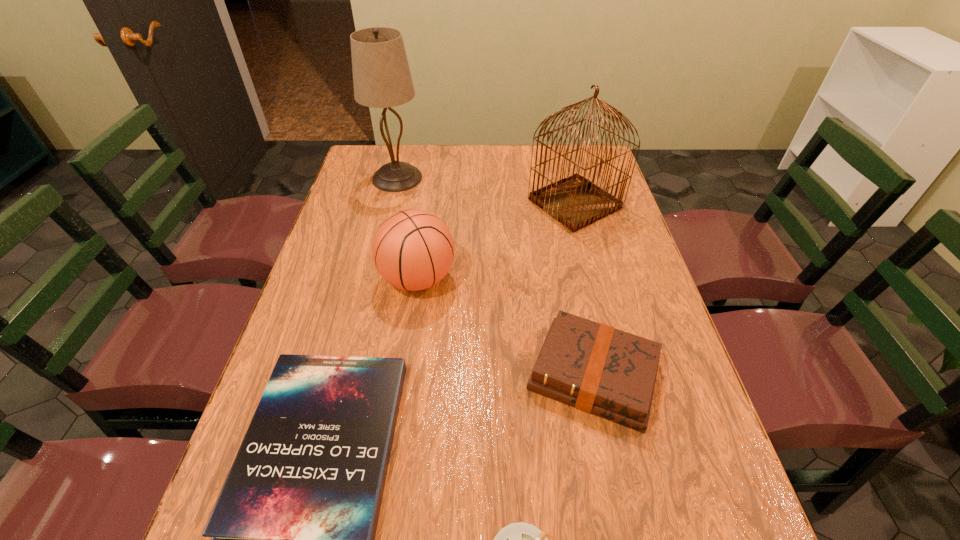
The height and width of the screenshot is (540, 960). In order to click on the tallest object in this screenshot , I will do `click(381, 75)`.

At what (x,y) coordinates should I click in order to perform the action: click on birdcage. Please return your answer as a coordinate pair (x, y). Looking at the image, I should click on (576, 202).

Image resolution: width=960 pixels, height=540 pixels. Find the location of `the third tallest object`. the third tallest object is located at coordinates pyautogui.click(x=412, y=249).

This screenshot has width=960, height=540. What are the coordinates of `basketball` in the screenshot? It's located at (412, 249).

Where is `the right hardback book`? the right hardback book is located at coordinates (598, 369).

I want to click on the taller hardback book, so click(598, 369).

At what (x,y) coordinates should I click in order to perform the action: click on free spot located 0.220m on the front-facing side of the lampshade. Please return your answer as a coordinate pair (x, y). This screenshot has width=960, height=540. Looking at the image, I should click on (383, 235).

Locate an element on the screen. The height and width of the screenshot is (540, 960). vacant space located on the back of the birdcage is located at coordinates (561, 148).

This screenshot has width=960, height=540. Find the location of `vacant region located 0.320m on the front of the fourth shortest object`. vacant region located 0.320m on the front of the fourth shortest object is located at coordinates (396, 428).

Where is `blank space located 0.360m on the left of the right hardback book`? This screenshot has height=540, width=960. blank space located 0.360m on the left of the right hardback book is located at coordinates point(362,375).